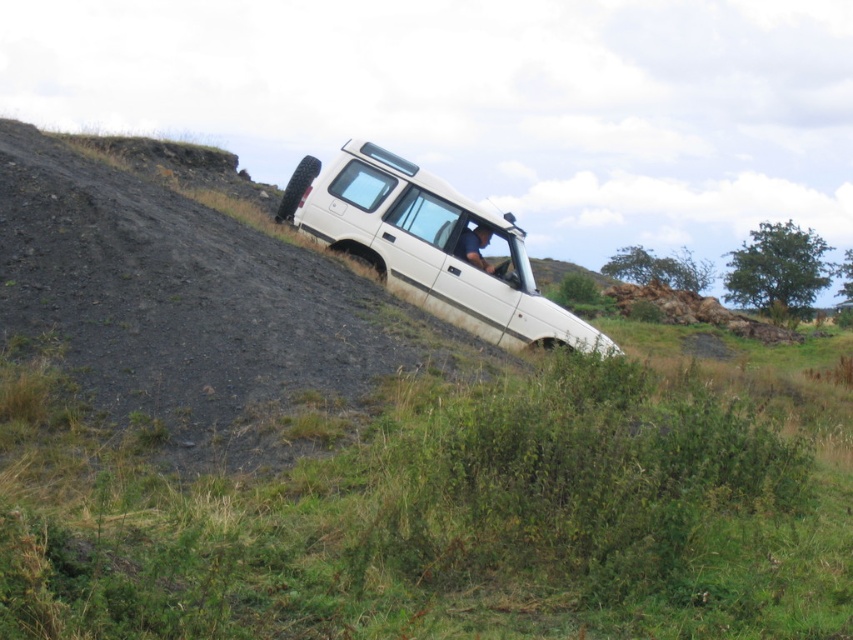
You are a delivery person trying to secure a dark blue fabric at center onto a white matte suv at center. Based on their sizes, will the fabric cover the entire suv?

The white matte suv at center is wider than the dark blue fabric at center, so the fabric will not fully cover the entire suv.

You are a drone operator trying to capture a photo of the white matte suv at center. The drone is currently at point (431, 248). Is the drone above or below the white matte suv at center?

The point (431, 248) indicates the white matte suv at center, so the drone is positioned exactly at the location of the white matte suv at center. Therefore, the drone is neither above nor below it but directly at its position.